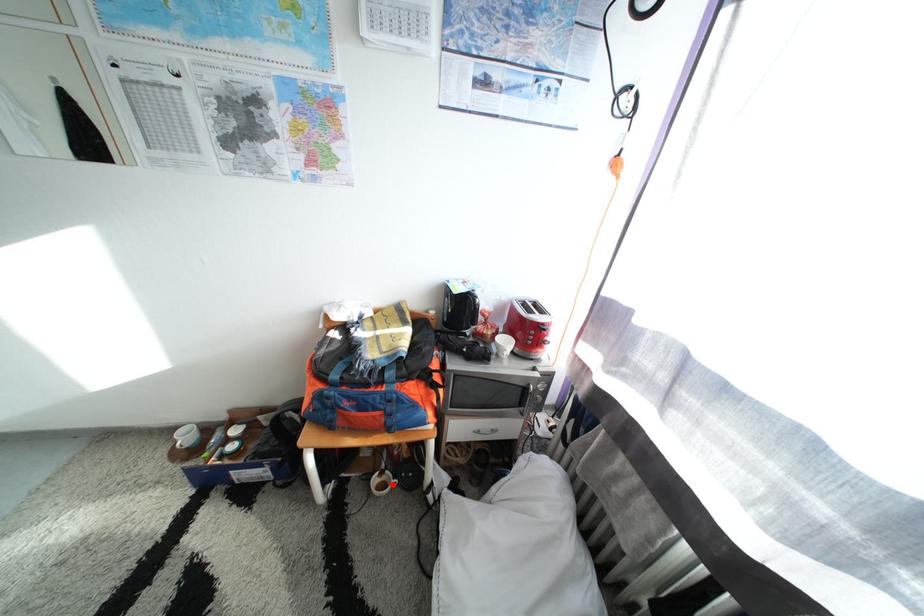
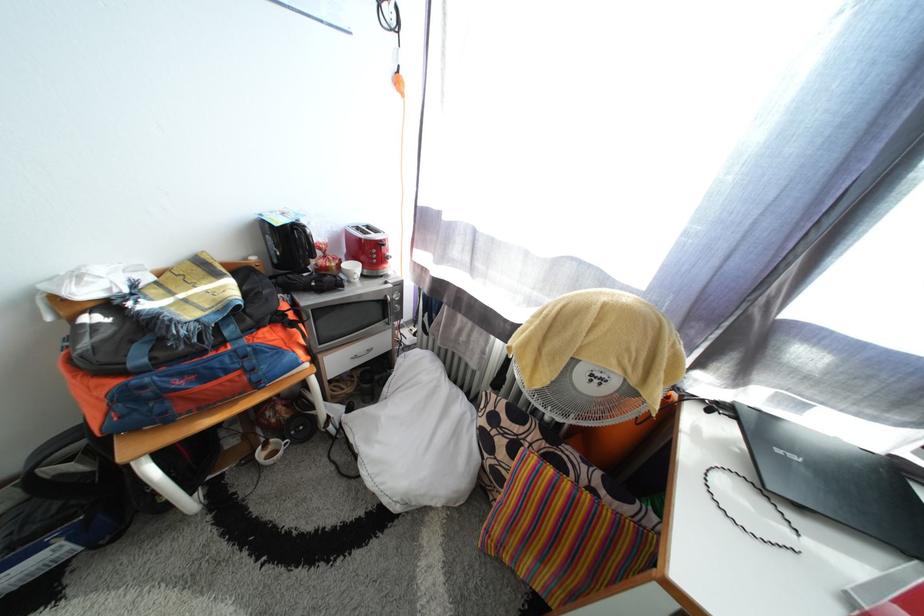
Question: I am providing you with two images of the same scene from different viewpoints. A red point is shown in image1. For the corresponding object point in image2, is it positioned nearer or farther from the camera?

Choices:
 (A) Nearer
 (B) Farther

Answer: (A)